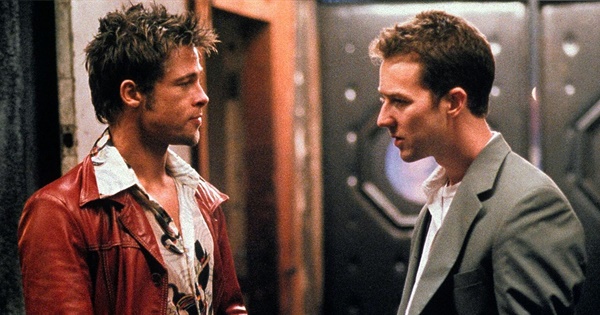
This screenshot has height=315, width=600. I want to click on door, so click(349, 80).